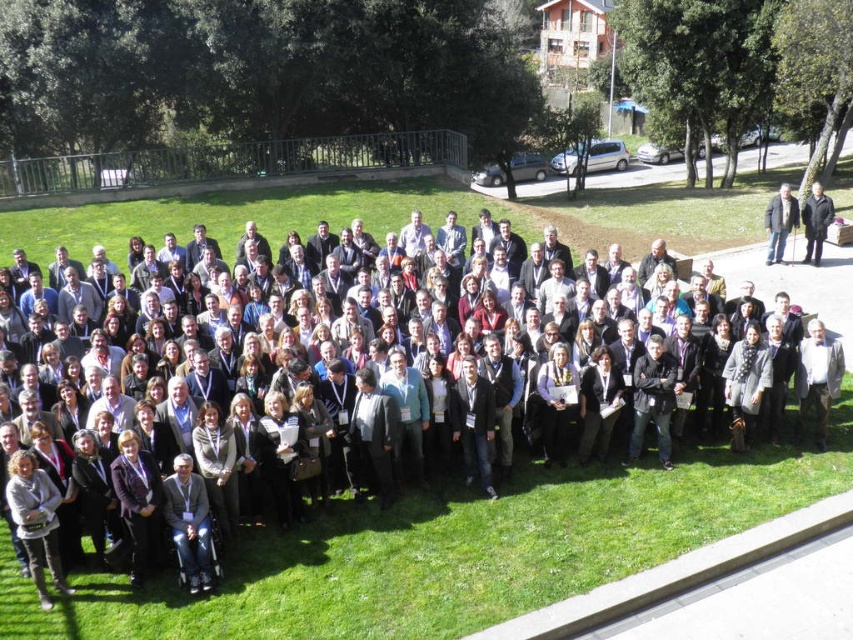
You are an event organizer trying to arrange seating for the group. You notice two attendees wearing a dark gray suit at right and a black wool coat at right. Which of these two is wider?

The dark gray suit at right is wider than the black wool coat at right according to the description.

You are a photographer trying to capture a photo of the light brown wool sweater at lower left without including the dark gray suit at center in the frame. Is this possible given their positions?

The dark gray suit at center is in front of the light brown wool sweater at lower left, so it would block the view. Therefore, it is not possible to capture the light brown wool sweater at lower left without including the dark gray suit at center in the frame.